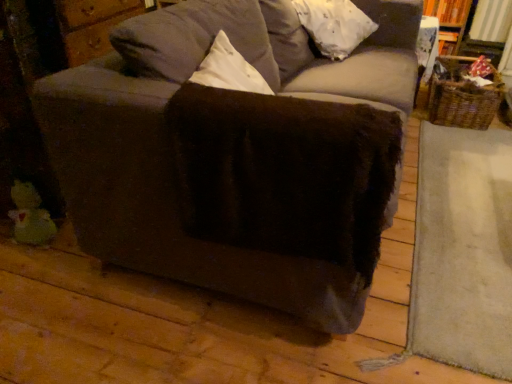
Question: Is white fluffy pillow at upper center outside of woven brown basket at right?

Choices:
 (A) yes
 (B) no

Answer: (A)

Question: Is the depth of white fluffy pillow at upper center greater than that of woven brown basket at right?

Choices:
 (A) no
 (B) yes

Answer: (A)

Question: Could you tell me if white fluffy pillow at upper center is turned towards woven brown basket at right?

Choices:
 (A) no
 (B) yes

Answer: (A)

Question: Is white fluffy pillow at upper center thinner than woven brown basket at right?

Choices:
 (A) yes
 (B) no

Answer: (A)

Question: Is white fluffy pillow at upper center in front of woven brown basket at right?

Choices:
 (A) yes
 (B) no

Answer: (A)

Question: Does white fluffy pillow at upper center have a greater width compared to woven brown basket at right?

Choices:
 (A) no
 (B) yes

Answer: (A)

Question: Does velvet gray couch at center have a greater height compared to white fluffy pillow at upper center?

Choices:
 (A) no
 (B) yes

Answer: (B)

Question: Is velvet gray couch at center looking in the opposite direction of white fluffy pillow at upper center?

Choices:
 (A) no
 (B) yes

Answer: (B)

Question: Is velvet gray couch at center bigger than white fluffy pillow at upper center?

Choices:
 (A) yes
 (B) no

Answer: (A)

Question: Considering the relative sizes of velvet gray couch at center and white fluffy pillow at upper center in the image provided, is velvet gray couch at center wider than white fluffy pillow at upper center?

Choices:
 (A) no
 (B) yes

Answer: (B)

Question: Can you confirm if velvet gray couch at center is smaller than white fluffy pillow at upper center?

Choices:
 (A) no
 (B) yes

Answer: (A)

Question: Would you say white fluffy pillow at upper center is part of velvet gray couch at center's contents?

Choices:
 (A) yes
 (B) no

Answer: (A)

Question: From a real-world perspective, is velvet gray couch at center positioned under woven brown basket at right based on gravity?

Choices:
 (A) yes
 (B) no

Answer: (B)